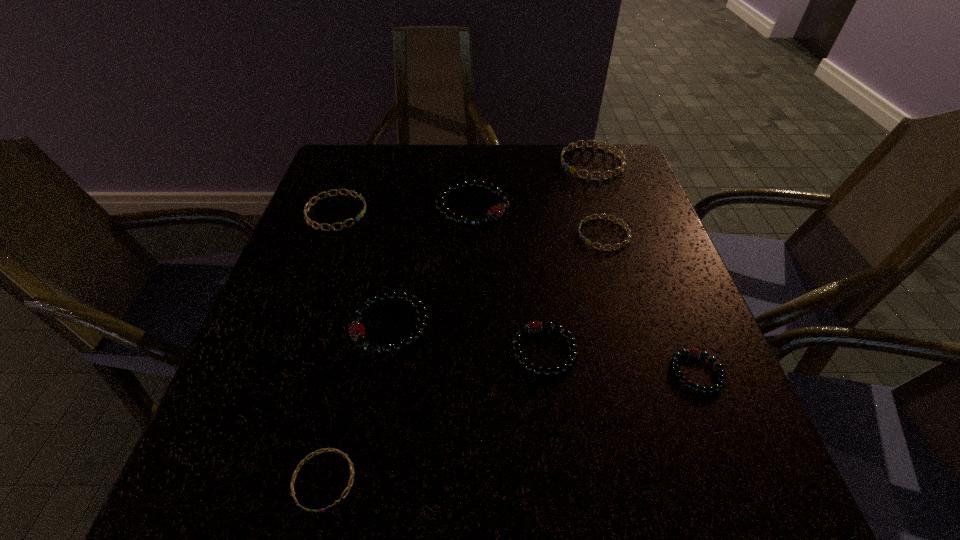
Locate an element on the screen. This screenshot has height=540, width=960. free location that satisfies the following two spatial constraints: 1. on the surface of the farthest bracelet showing star-shaped elements; 2. on the surface of the second blue bracelet from left to right showing star-shaped elements is located at coordinates (696, 480).

The image size is (960, 540). I want to click on vacant space that satisfies the following two spatial constraints: 1. on the surface of the third biggest blue bracelet showing star-shaped elements; 2. on the surface of the nearest object showing star-shaped elements, so click(x=678, y=480).

Image resolution: width=960 pixels, height=540 pixels. I want to click on free location that satisfies the following two spatial constraints: 1. on the surface of the second smallest blue bracelet showing star-shaped elements; 2. on the surface of the second blue bracelet from left to right showing star-shaped elements, so click(678, 480).

Find the location of `free spot that satisfies the following two spatial constraints: 1. on the front side of the second biggest black bracelet; 2. on the left side of the third biggest black bracelet`. free spot that satisfies the following two spatial constraints: 1. on the front side of the second biggest black bracelet; 2. on the left side of the third biggest black bracelet is located at coordinates (385, 351).

I want to click on free space that satisfies the following two spatial constraints: 1. on the surface of the farthest bracelet showing star-shaped elements; 2. on the surface of the nearest object showing star-shaped elements, so [x=696, y=480].